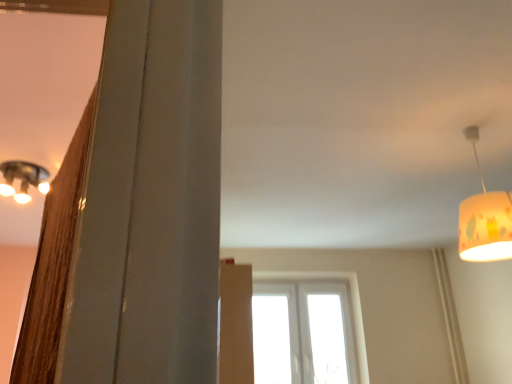
Question: From a real-world perspective, is yellow fabric lampshade at upper right positioned over transparent glass window at center based on gravity?

Choices:
 (A) no
 (B) yes

Answer: (B)

Question: From the image's perspective, does yellow fabric lampshade at upper right appear higher than transparent glass window at center?

Choices:
 (A) yes
 (B) no

Answer: (A)

Question: Is yellow fabric lampshade at upper right thinner than transparent glass window at center?

Choices:
 (A) yes
 (B) no

Answer: (B)

Question: Does yellow fabric lampshade at upper right come behind transparent glass window at center?

Choices:
 (A) yes
 (B) no

Answer: (B)

Question: Is yellow fabric lampshade at upper right not within transparent glass window at center?

Choices:
 (A) no
 (B) yes

Answer: (B)

Question: Is yellow fabric lampshade at upper right in front of transparent glass window at center?

Choices:
 (A) yes
 (B) no

Answer: (A)

Question: Is transparent glass window at center facing towards yellow fabric lampshade at upper right?

Choices:
 (A) no
 (B) yes

Answer: (B)

Question: Is transparent glass window at center taller than yellow fabric lampshade at upper right?

Choices:
 (A) no
 (B) yes

Answer: (B)

Question: From the image's perspective, is transparent glass window at center on top of yellow fabric lampshade at upper right?

Choices:
 (A) yes
 (B) no

Answer: (B)

Question: Is yellow fabric lampshade at upper right inside transparent glass window at center?

Choices:
 (A) no
 (B) yes

Answer: (A)

Question: Can you confirm if transparent glass window at center is positioned to the right of yellow fabric lampshade at upper right?

Choices:
 (A) no
 (B) yes

Answer: (A)

Question: Is transparent glass window at center facing away from yellow fabric lampshade at upper right?

Choices:
 (A) yes
 (B) no

Answer: (B)

Question: From a real-world perspective, relative to yellow fabric lampshade at upper right, is transparent glass window at center vertically above or below?

Choices:
 (A) above
 (B) below

Answer: (B)